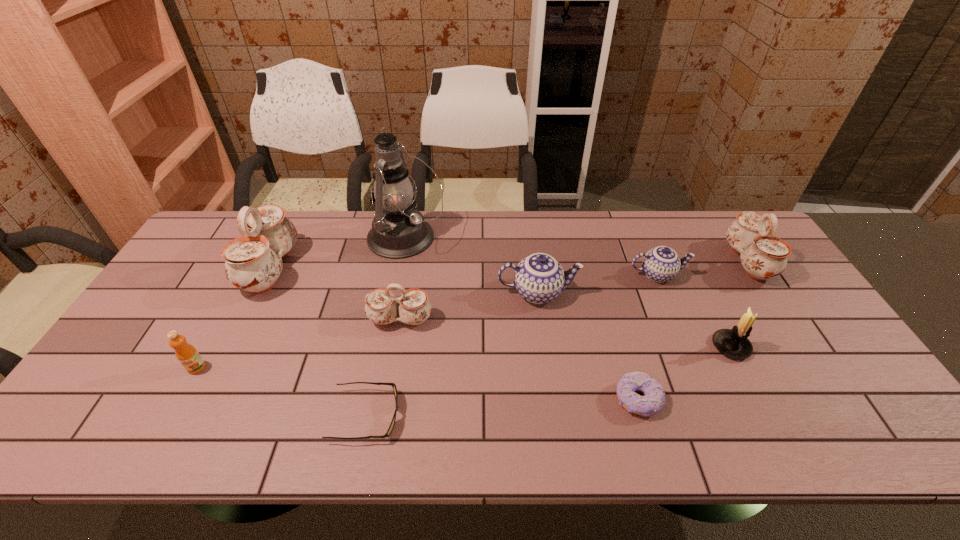
This screenshot has width=960, height=540. In order to click on blank region between the brown doughnut and the rightmost chinaware in this screenshot , I will do `click(693, 330)`.

Where is `empty space between the orange juice and the sixth object from left to right`? The image size is (960, 540). empty space between the orange juice and the sixth object from left to right is located at coordinates 368,330.

You are a GUI agent. You are given a task and a screenshot of the screen. Output one action in this format:
    pyautogui.click(x=<x>, y=<y>)
    Task: Click on the vacant space in between the shortest object and the fourth object from right to left
    
    Given the screenshot: What is the action you would take?
    pyautogui.click(x=502, y=408)

At what (x,y) coordinates should I click in order to perform the action: click on empty location between the candle holder and the orange juice. Please return your answer as a coordinate pair (x, y). Looking at the image, I should click on (464, 357).

Where is `empty location between the oil lamp and the bigger blue chinaware`? This screenshot has height=540, width=960. empty location between the oil lamp and the bigger blue chinaware is located at coordinates (472, 265).

This screenshot has width=960, height=540. Find the location of `empty location between the shortest chinaware and the ninth tallest object`. empty location between the shortest chinaware and the ninth tallest object is located at coordinates (648, 337).

I want to click on vacant region between the bigger blue chinaware and the oil lamp, so click(x=472, y=265).

Select which object appears as the ninth closest to the candle holder. Please provide its 2D coordinates. Your answer should be formatted as a tuple, i.e. [(x, y)], where the tuple contains the x and y coordinates of a point satisfying the conditions above.

[(188, 356)]

Identify which object is the eighth closest to the rightmost chinaware. Please provide its 2D coordinates. Your answer should be formatted as a tuple, i.e. [(x, y)], where the tuple contains the x and y coordinates of a point satisfying the conditions above.

[(253, 262)]

This screenshot has height=540, width=960. What are the coordinates of `chinaware that is the fourth nearest to the second chinaware from right to left` in the screenshot? It's located at (253, 262).